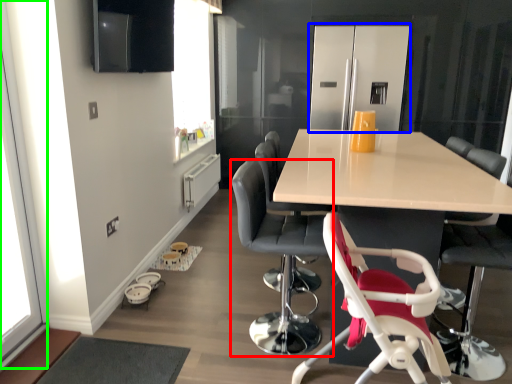
Question: Estimate the real-world distances between objects in this image. Which object is closer to chair (highlighted by a red box), appliance (highlighted by a blue box) or window screen (highlighted by a green box)?

Choices:
 (A) appliance
 (B) window screen

Answer: (B)